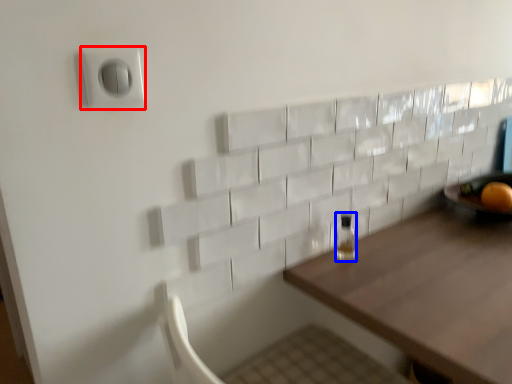
Question: Which object appears farthest to the camera in this image, electric outlet (highlighted by a red box) or bottle (highlighted by a blue box)?

Choices:
 (A) electric outlet
 (B) bottle

Answer: (B)